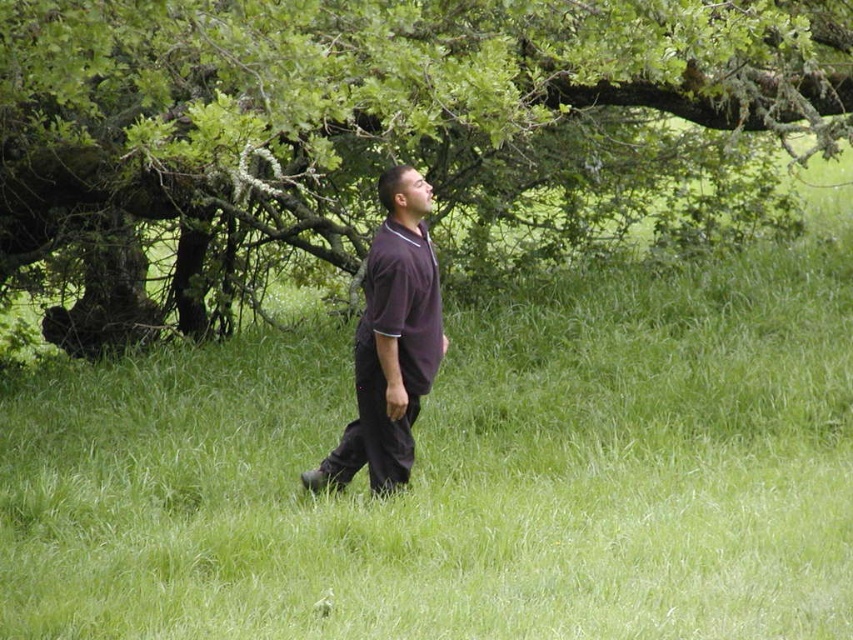
Question: Can you confirm if green leafy tree at upper center is positioned to the left of purple smooth shirt at center?

Choices:
 (A) no
 (B) yes

Answer: (B)

Question: Which of the following is the farthest from the observer?

Choices:
 (A) purple smooth shirt at center
 (B) green leafy tree at upper center

Answer: (A)

Question: Does green leafy tree at upper center have a lesser width compared to purple smooth shirt at center?

Choices:
 (A) yes
 (B) no

Answer: (B)

Question: Is green leafy tree at upper center positioned behind purple smooth shirt at center?

Choices:
 (A) yes
 (B) no

Answer: (B)

Question: Which point is closer to the camera taking this photo?

Choices:
 (A) (438, 349)
 (B) (611, 166)

Answer: (A)